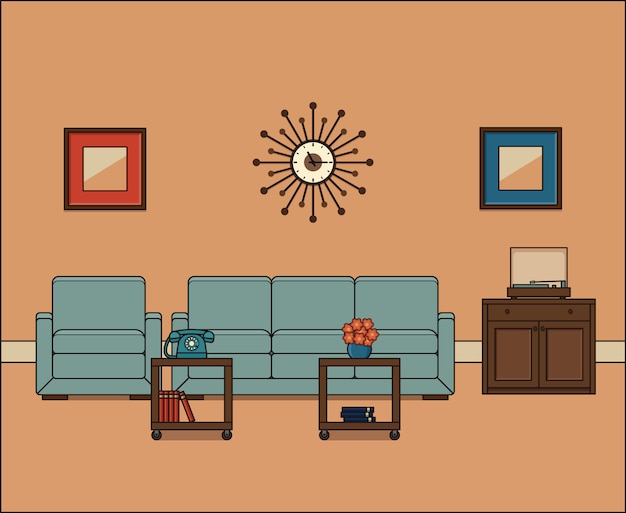
At what (x,y) coordinates should I click in order to perform the action: click on wheeled side table. Please return your answer as a coordinate pair (x, y). The height and width of the screenshot is (513, 626). Looking at the image, I should click on (230, 422), (329, 423).